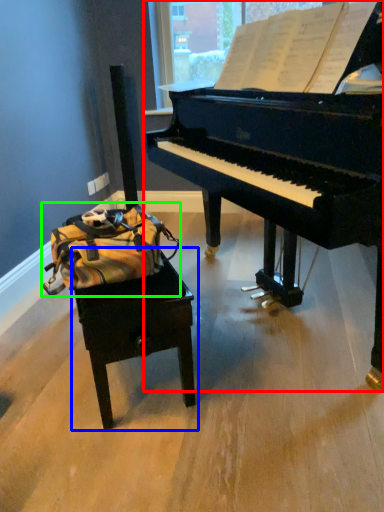
Question: Considering the real-world distances, which object is closest to piano (highlighted by a red box)? table (highlighted by a blue box) or messenger bag (highlighted by a green box).

Choices:
 (A) table
 (B) messenger bag

Answer: (B)